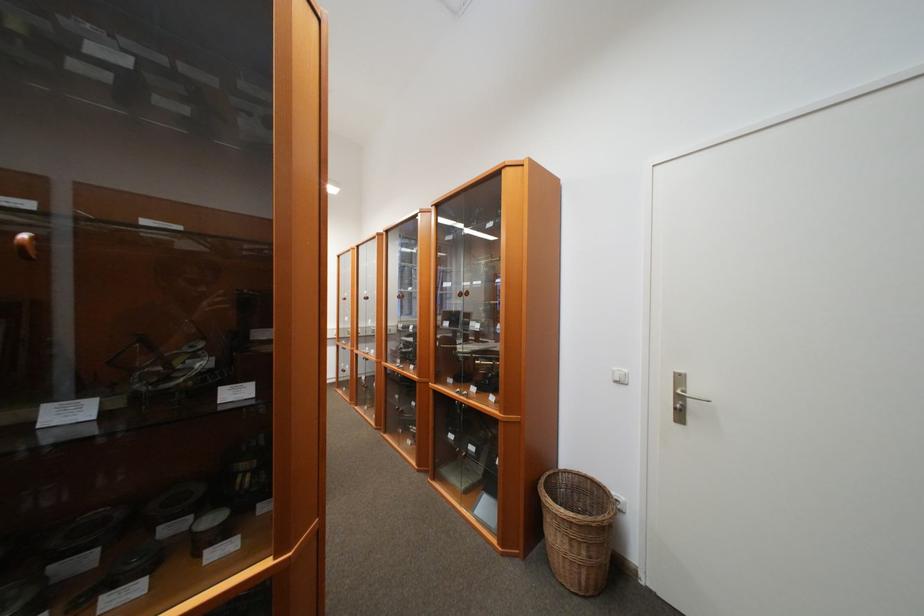
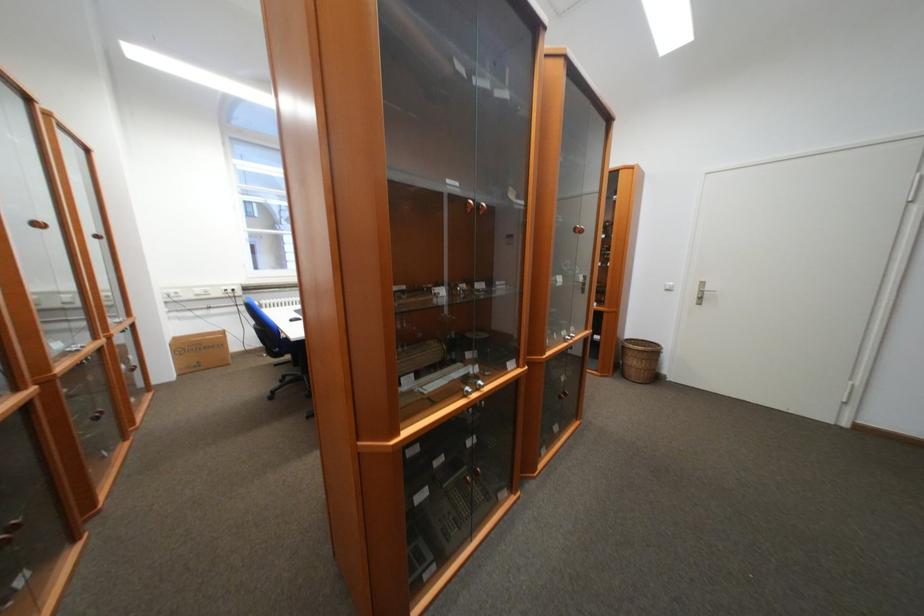
Find the pixel in the second image that matches pixel 689 399 in the first image.

(711, 293)